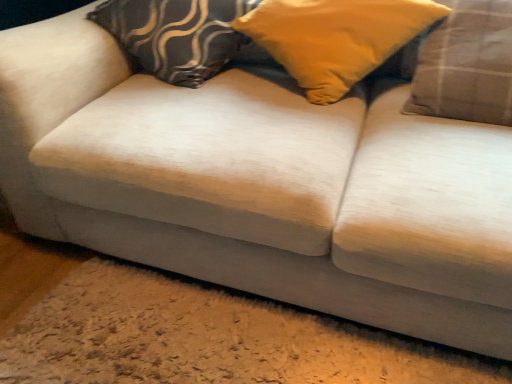
Question: From the image's perspective, is plaid fabric pillow at right, which is the third pillow from left to right, below velvet-patterned pillow at center, the third pillow in the right-to-left sequence?

Choices:
 (A) no
 (B) yes

Answer: (B)

Question: Does plaid fabric pillow at right, which is the third pillow from left to right, appear on the left side of velvet-patterned pillow at center, the third pillow in the right-to-left sequence?

Choices:
 (A) yes
 (B) no

Answer: (B)

Question: Is plaid fabric pillow at right, which is the first pillow from right to left, far from velvet-patterned pillow at center, which ranks as the first pillow in left-to-right order?

Choices:
 (A) yes
 (B) no

Answer: (B)

Question: From a real-world perspective, is plaid fabric pillow at right, which is the third pillow from left to right, on top of velvet-patterned pillow at center, which ranks as the first pillow in left-to-right order?

Choices:
 (A) yes
 (B) no

Answer: (A)

Question: Is plaid fabric pillow at right, which is the first pillow from right to left, positioned behind velvet-patterned pillow at center, the third pillow in the right-to-left sequence?

Choices:
 (A) yes
 (B) no

Answer: (B)

Question: Is point click(x=385, y=48) positioned closer to the camera than point click(x=497, y=96)?

Choices:
 (A) farther
 (B) closer

Answer: (A)

Question: Relative to plaid fabric pillow at right, which is the first pillow from right to left, is yellow fabric pillow at center, the 2th pillow viewed from the left, in front or behind?

Choices:
 (A) behind
 (B) front

Answer: (A)

Question: Is yellow fabric pillow at center, marked as the 2th pillow in a right-to-left arrangement, inside or outside of plaid fabric pillow at right, which is the first pillow from right to left?

Choices:
 (A) inside
 (B) outside

Answer: (B)

Question: From a real-world perspective, is yellow fabric pillow at center, marked as the 2th pillow in a right-to-left arrangement, positioned above or below plaid fabric pillow at right, which is the third pillow from left to right?

Choices:
 (A) below
 (B) above

Answer: (B)

Question: Is yellow fabric pillow at center, marked as the 2th pillow in a right-to-left arrangement, in front of or behind velvet-patterned pillow at center, which ranks as the first pillow in left-to-right order, in the image?

Choices:
 (A) behind
 (B) front

Answer: (B)

Question: Considering the positions of point (263, 19) and point (110, 13), is point (263, 19) closer or farther from the camera than point (110, 13)?

Choices:
 (A) closer
 (B) farther

Answer: (A)

Question: From the image's perspective, relative to velvet-patterned pillow at center, the third pillow in the right-to-left sequence, is yellow fabric pillow at center, marked as the 2th pillow in a right-to-left arrangement, above or below?

Choices:
 (A) above
 (B) below

Answer: (B)

Question: Considering the positions of yellow fabric pillow at center, marked as the 2th pillow in a right-to-left arrangement, and velvet-patterned pillow at center, which ranks as the first pillow in left-to-right order, in the image, is yellow fabric pillow at center, marked as the 2th pillow in a right-to-left arrangement, wider or thinner than velvet-patterned pillow at center, which ranks as the first pillow in left-to-right order,?

Choices:
 (A) thin
 (B) wide

Answer: (B)

Question: From a real-world perspective, is plaid fabric pillow at right, which is the third pillow from left to right, positioned above or below yellow fabric pillow at center, the 2th pillow viewed from the left?

Choices:
 (A) above
 (B) below

Answer: (B)

Question: Is plaid fabric pillow at right, which is the third pillow from left to right, inside or outside of yellow fabric pillow at center, the 2th pillow viewed from the left?

Choices:
 (A) inside
 (B) outside

Answer: (A)